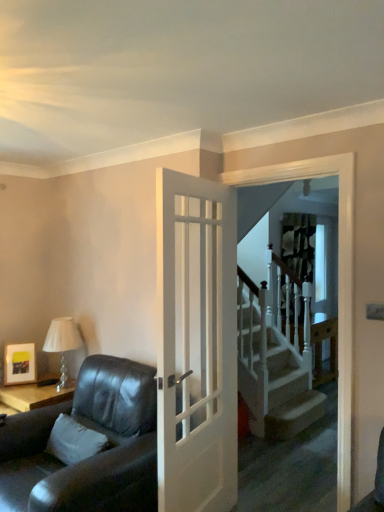
Question: Is matte black picture frame at upper left facing away from white glossy screen door at upper center?

Choices:
 (A) yes
 (B) no

Answer: (B)

Question: Is matte black picture frame at upper left facing towards white glossy screen door at upper center?

Choices:
 (A) yes
 (B) no

Answer: (B)

Question: Does matte black picture frame at upper left have a larger size compared to white glossy screen door at upper center?

Choices:
 (A) yes
 (B) no

Answer: (B)

Question: From the image's perspective, does matte black picture frame at upper left appear higher than white glossy screen door at upper center?

Choices:
 (A) no
 (B) yes

Answer: (A)

Question: Can you confirm if matte black picture frame at upper left is shorter than white glossy screen door at upper center?

Choices:
 (A) yes
 (B) no

Answer: (A)

Question: From the image's perspective, is matte black picture frame at upper left positioned above or below white glossy screen door at upper center?

Choices:
 (A) above
 (B) below

Answer: (B)

Question: Considering the positions of matte black picture frame at upper left and white glossy screen door at upper center in the image, is matte black picture frame at upper left taller or shorter than white glossy screen door at upper center?

Choices:
 (A) tall
 (B) short

Answer: (B)

Question: Based on their positions, is matte black picture frame at upper left located to the left or right of white glossy screen door at upper center?

Choices:
 (A) left
 (B) right

Answer: (A)

Question: Looking at the image, does matte black picture frame at upper left seem bigger or smaller compared to white glossy screen door at upper center?

Choices:
 (A) big
 (B) small

Answer: (B)

Question: Looking at their shapes, would you say leather couch at left is wider or thinner than white glossy screen door at upper center?

Choices:
 (A) wide
 (B) thin

Answer: (A)

Question: Considering their positions, is leather couch at left located in front of or behind white glossy screen door at upper center?

Choices:
 (A) front
 (B) behind

Answer: (A)

Question: Based on their sizes in the image, would you say leather couch at left is bigger or smaller than white glossy screen door at upper center?

Choices:
 (A) small
 (B) big

Answer: (B)

Question: From the image's perspective, relative to white glossy screen door at upper center, is leather couch at left above or below?

Choices:
 (A) below
 (B) above

Answer: (A)

Question: Considering the positions of matte black picture frame at upper left and white glass table lamp at left in the image, is matte black picture frame at upper left bigger or smaller than white glass table lamp at left?

Choices:
 (A) small
 (B) big

Answer: (A)

Question: Relative to white glass table lamp at left, is matte black picture frame at upper left in front or behind?

Choices:
 (A) behind
 (B) front

Answer: (A)